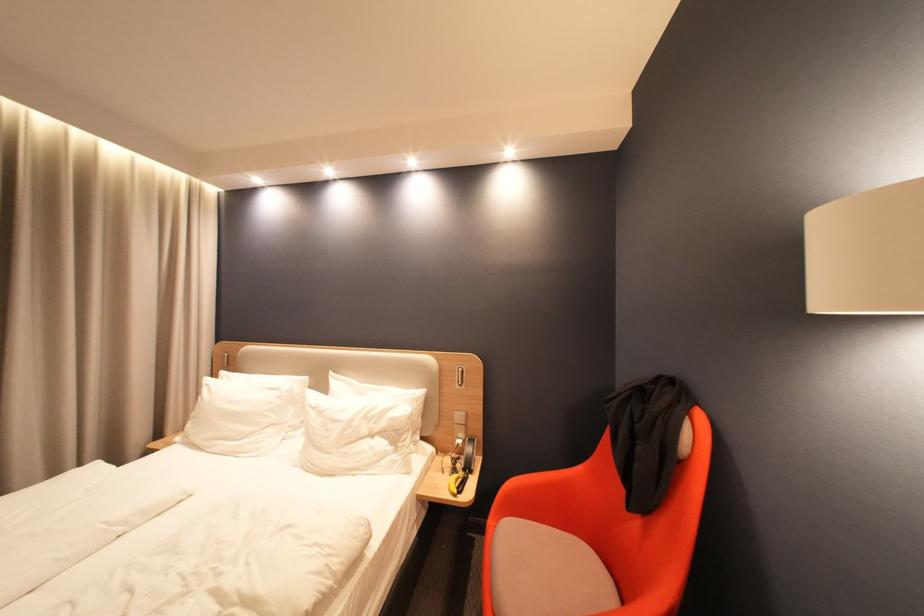
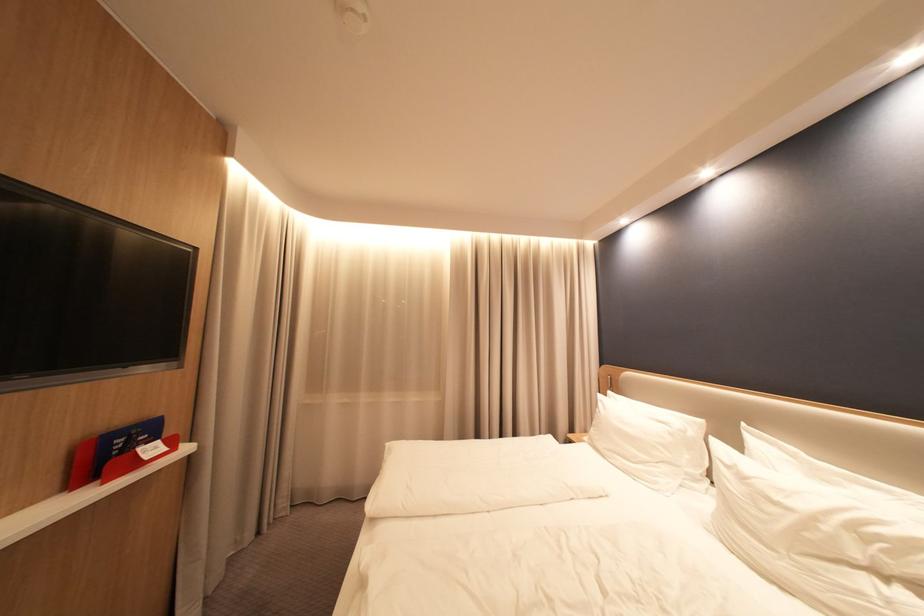
Where in the second image is the point corresponding to point 226,378 from the first image?

(615, 397)